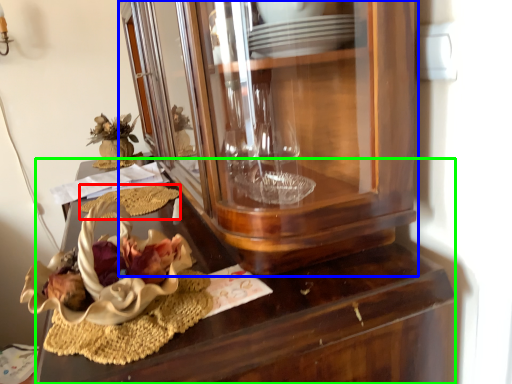
Question: Which is nearer to the food (highlighted by a red box)? cabinetry (highlighted by a blue box) or desk (highlighted by a green box).

Choices:
 (A) cabinetry
 (B) desk

Answer: (B)